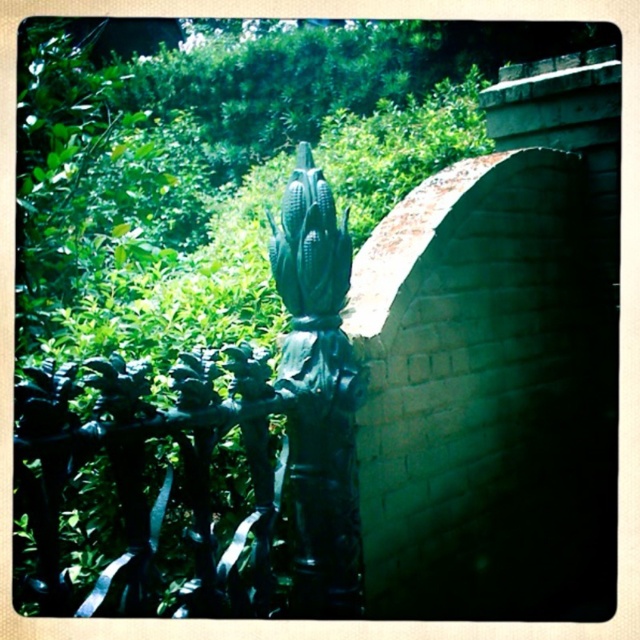
In the scene, there is a black metal railing with intricate designs and a point marked at coordinates [141,470]. What is the color of the object located at this point?

The point at [141,470] marks dark green wrought iron at left.

You are standing in the outdoor scene and need to locate the dark green wrought iron at left. According to the coordinates provided, where exactly is it positioned?

The dark green wrought iron at left is located at point coordinates of (141, 470).

You are standing in the outdoor scene and want to move from the dark green wrought iron at left to the green matte corn cob at center. Which direction should you move to reach the corn cob?

You should move to the right to reach the green matte corn cob at center from the dark green wrought iron at left since the dark green wrought iron at left is located to the left of the corn cob.